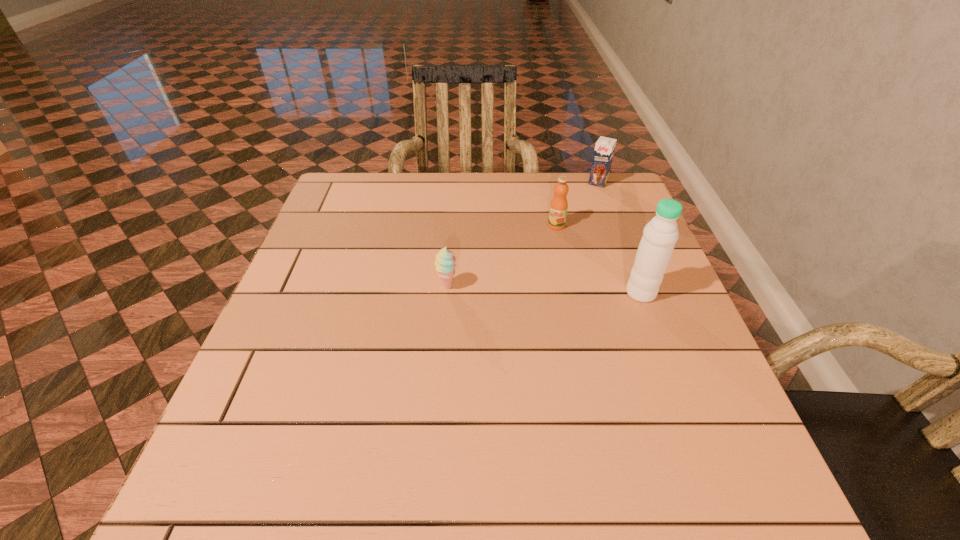
The height and width of the screenshot is (540, 960). In the image, there is a desktop. Find the location of `vacant space at the left edge`. vacant space at the left edge is located at coordinates 308,317.

Image resolution: width=960 pixels, height=540 pixels. What are the coordinates of `vacant region at the right edge of the desktop` in the screenshot? It's located at (593, 244).

In the image, there is a desktop. Identify the location of free region at the far left corner. The height and width of the screenshot is (540, 960). (351, 179).

Where is `free space at the far right corner of the desktop`? free space at the far right corner of the desktop is located at coordinates (614, 198).

In the image, there is a desktop. Where is `vacant region at the near right corner`? vacant region at the near right corner is located at coordinates (731, 437).

I want to click on vacant area between the third nearest object and the water bottle, so click(598, 259).

You are a GUI agent. You are given a task and a screenshot of the screen. Output one action in this format:
    pyautogui.click(x=<x>, y=<y>)
    Task: Click on the empty space between the chocolate milk and the orange juice
    The image size is (960, 540).
    Given the screenshot: What is the action you would take?
    pyautogui.click(x=577, y=204)

Locate an element on the screen. The image size is (960, 540). empty location between the second farthest object and the water bottle is located at coordinates (598, 259).

Where is `free space that is in between the leftmost object and the tallest object`? The image size is (960, 540). free space that is in between the leftmost object and the tallest object is located at coordinates (544, 289).

Identify the location of vacant point located between the orange juice and the leftmost object. Image resolution: width=960 pixels, height=540 pixels. (501, 255).